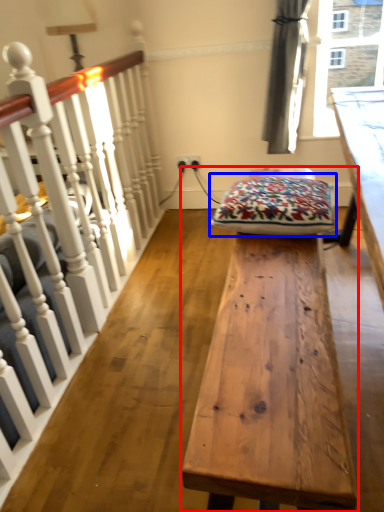
Question: Which point is closer to the camera, table (highlighted by a red box) or blanket (highlighted by a blue box)?

Choices:
 (A) table
 (B) blanket

Answer: (A)